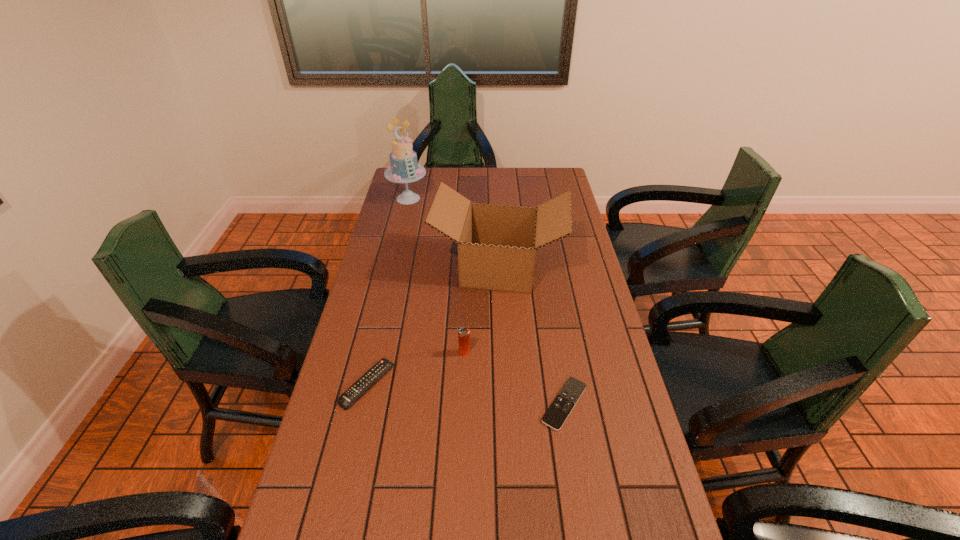
Locate an element on the screen. free region that satisfies the following two spatial constraints: 1. with a ladder on the side of the left remote control; 2. on the left side of the cake is located at coordinates (365, 384).

Locate an element on the screen. This screenshot has width=960, height=540. free space that satisfies the following two spatial constraints: 1. with a ladder on the side of the second farthest object; 2. on the right side of the cake is located at coordinates (392, 267).